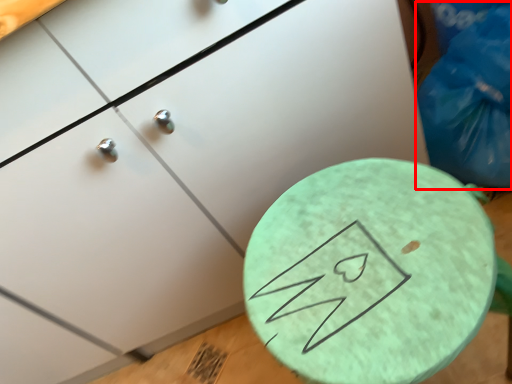
Question: From the image, what is the correct spatial relationship of garbage (annotated by the red box) in relation to round table?

Choices:
 (A) left
 (B) right

Answer: (B)